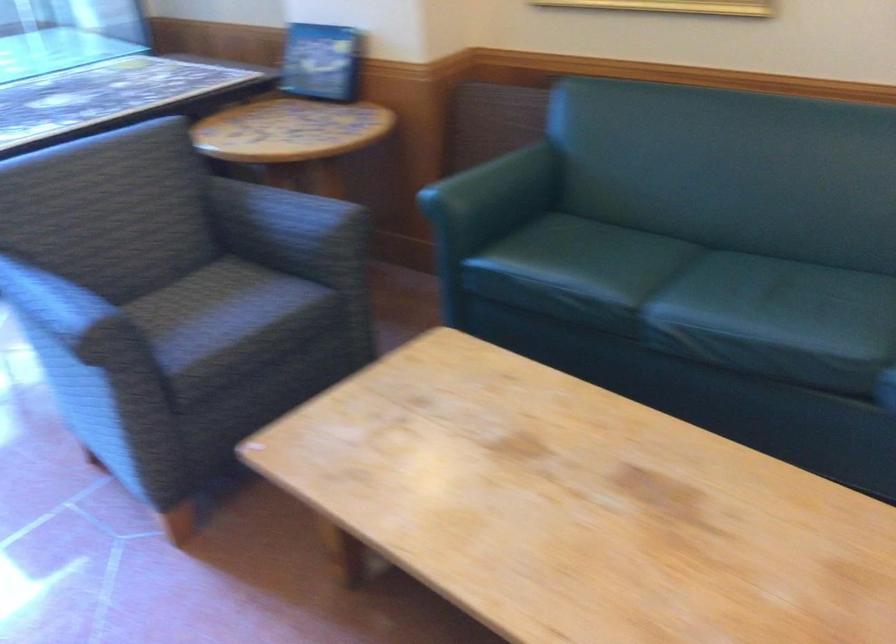
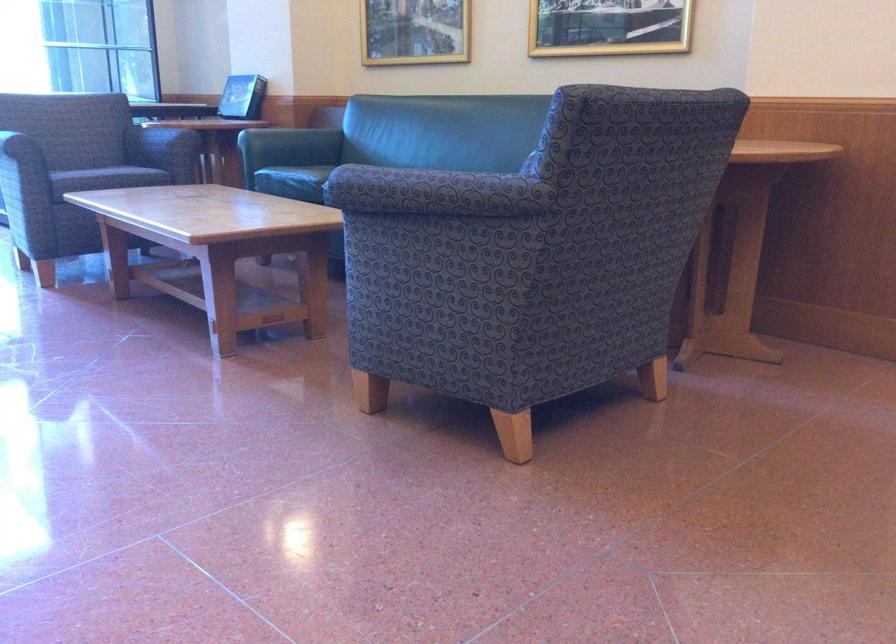
Locate, in the second image, the point that corresponds to (x=565, y=299) in the first image.

(293, 182)